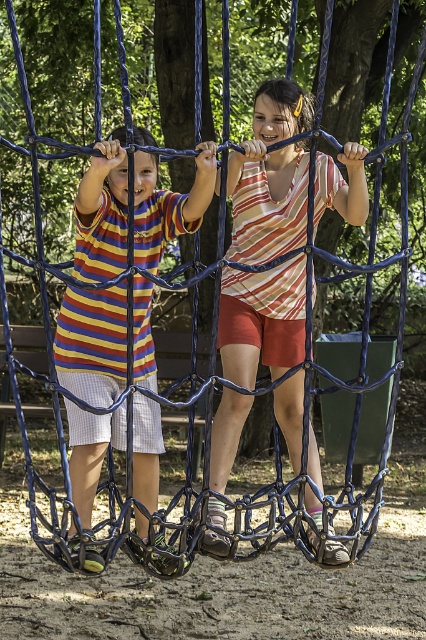
Question: Which object appears farthest from the camera in this image?

Choices:
 (A) matte striped shirt at left
 (B) striped cotton shirt at center

Answer: (B)

Question: From the image, what is the correct spatial relationship of striped cotton shirt at center in relation to matte striped shirt at left?

Choices:
 (A) above
 (B) below

Answer: (A)

Question: Is striped cotton shirt at center bigger than matte striped shirt at left?

Choices:
 (A) yes
 (B) no

Answer: (A)

Question: Does striped cotton shirt at center appear on the right side of matte striped shirt at left?

Choices:
 (A) yes
 (B) no

Answer: (A)